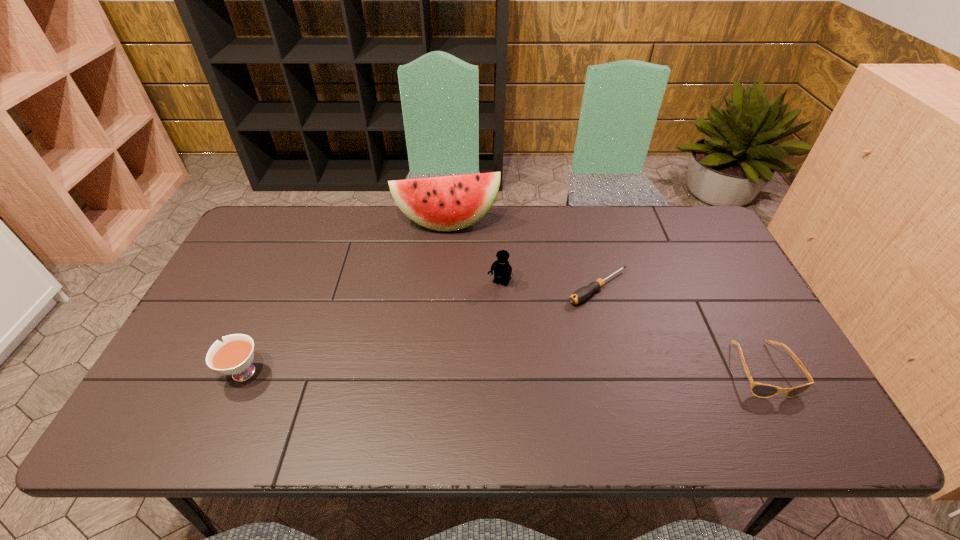
Where is `vacant space on the desktop that is between the third tallest object and the rightmost object and is positioned on the front-facing side of the Lego`? vacant space on the desktop that is between the third tallest object and the rightmost object and is positioned on the front-facing side of the Lego is located at coordinates (453, 371).

Locate an element on the screen. vacant spot on the desktop that is between the leftmost object and the rightmost object and is positioned at the tip of the screwdriver is located at coordinates (471, 371).

Find the location of `vacant space on the desktop that is between the teacup and the second shortest object and is positioned on the outer rind of the tallest object`. vacant space on the desktop that is between the teacup and the second shortest object and is positioned on the outer rind of the tallest object is located at coordinates (459, 371).